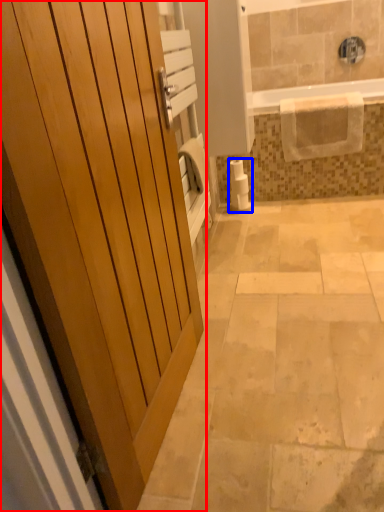
Question: Which object appears closest to the camera in this image, door (highlighted by a red box) or toilet paper (highlighted by a blue box)?

Choices:
 (A) door
 (B) toilet paper

Answer: (A)